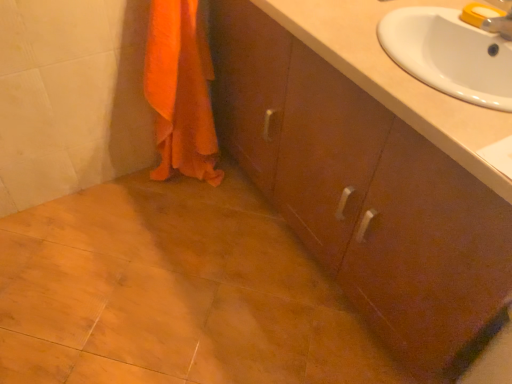
What are the coordinates of `vacant space positioned to the left of orange fabric towel at lower left` in the screenshot? It's located at (123, 189).